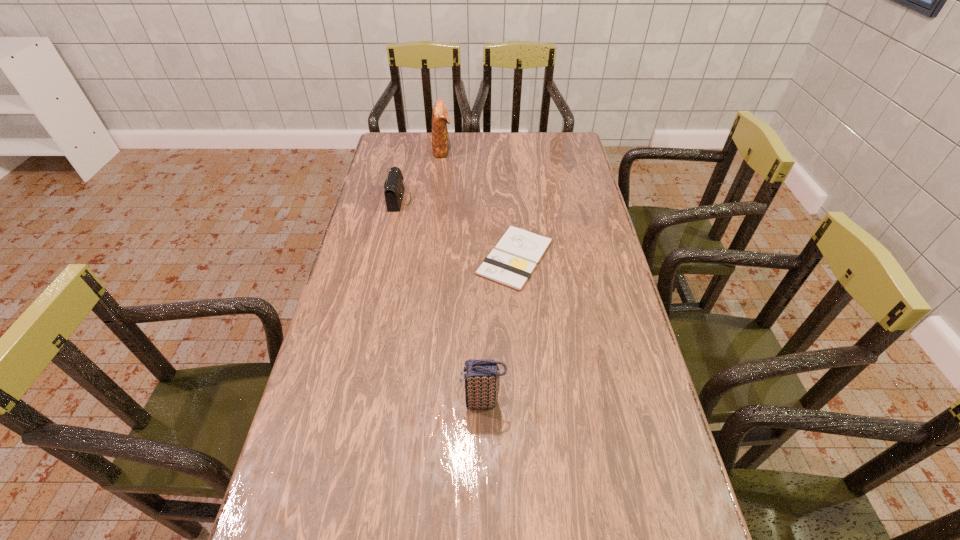
Where is `empty space between the shortest object and the rightmost clutch bag`? This screenshot has width=960, height=540. empty space between the shortest object and the rightmost clutch bag is located at coordinates (499, 330).

The height and width of the screenshot is (540, 960). Find the location of `the closest object relative to the third object from right to left`. the closest object relative to the third object from right to left is located at coordinates (394, 188).

Identify which object is the second nearest to the notepad. Please provide its 2D coordinates. Your answer should be formatted as a tuple, i.e. [(x, y)], where the tuple contains the x and y coordinates of a point satisfying the conditions above.

[(482, 377)]

This screenshot has width=960, height=540. I want to click on clutch bag identified as the second closest to the nearest object, so click(x=440, y=118).

Image resolution: width=960 pixels, height=540 pixels. I want to click on clutch bag object that ranks as the third closest to the shortest object, so click(440, 118).

Locate an element on the screen. blank area in the image that satisfies the following two spatial constraints: 1. on the front flap of the second nearest clutch bag; 2. on the right side of the second nearest object is located at coordinates (387, 258).

The height and width of the screenshot is (540, 960). I want to click on vacant area that satisfies the following two spatial constraints: 1. on the front flap of the second nearest clutch bag; 2. on the left side of the third farthest object, so click(387, 258).

You are a GUI agent. You are given a task and a screenshot of the screen. Output one action in this format:
    pyautogui.click(x=<x>, y=<y>)
    Task: Click on the vacant space that satisfies the following two spatial constraints: 1. on the open side of the second clutch bag from right to left; 2. on the right side of the third farthest object
    The height and width of the screenshot is (540, 960).
    Given the screenshot: What is the action you would take?
    pyautogui.click(x=430, y=258)

You are a GUI agent. You are given a task and a screenshot of the screen. Output one action in this format:
    pyautogui.click(x=<x>, y=<y>)
    Task: Click on the vacant space that satisfies the following two spatial constraints: 1. on the back side of the shortest object; 2. on the open side of the second clutch bag from left to right
    This screenshot has height=540, width=960.
    Given the screenshot: What is the action you would take?
    pyautogui.click(x=506, y=149)

The height and width of the screenshot is (540, 960). Find the location of `blank area in the image that satisfies the following two spatial constraints: 1. on the open side of the farthest clutch bag; 2. on the back side of the shortest object`. blank area in the image that satisfies the following two spatial constraints: 1. on the open side of the farthest clutch bag; 2. on the back side of the shortest object is located at coordinates (430, 258).